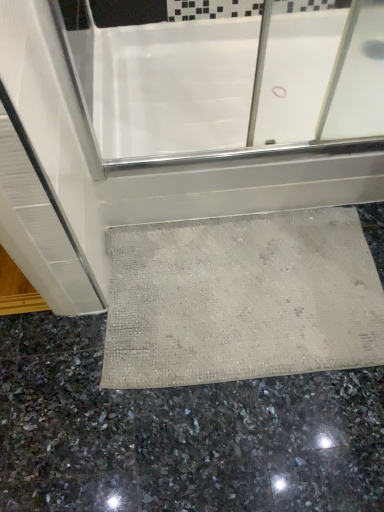
This screenshot has width=384, height=512. What do you see at coordinates (241, 298) in the screenshot? I see `beige textured bath mat at lower center` at bounding box center [241, 298].

Measure the distance between gray polished granite at lower center and camera.

They are 37.48 inches apart.

Describe the element at coordinates (291, 74) in the screenshot. I see `white glossy bathtub at center` at that location.

Find the location of `beige textured bath mat at lower center`. beige textured bath mat at lower center is located at coordinates (241, 298).

From a real-world perspective, which is physically below, white glossy bathtub at center or beige textured bath mat at lower center?

beige textured bath mat at lower center.

Can you confirm if white glossy bathtub at center is smaller than beige textured bath mat at lower center?

No.

Where is `bath mat below the white glossy bathtub at center (from the image's perspective)`? bath mat below the white glossy bathtub at center (from the image's perspective) is located at coordinates (241, 298).

Is white glossy bathtub at center thinner than beige textured bath mat at lower center?

No.

Does white glossy bathtub at center have a larger size compared to gray polished granite at lower center?

Indeed, white glossy bathtub at center has a larger size compared to gray polished granite at lower center.

Identify the location of bath above the gray polished granite at lower center (from a real-world perspective). Image resolution: width=384 pixels, height=512 pixels. pyautogui.click(x=291, y=74).

Is white glossy bathtub at center oriented away from gray polished granite at lower center?

white glossy bathtub at center is not turned away from gray polished granite at lower center.

Can we say white glossy bathtub at center lies outside gray polished granite at lower center?

Yes, white glossy bathtub at center is not within gray polished granite at lower center.

Is gray polished granite at lower center to the left of white glossy bathtub at center from the viewer's perspective?

Indeed, gray polished granite at lower center is positioned on the left side of white glossy bathtub at center.

Does gray polished granite at lower center have a greater height compared to white glossy bathtub at center?

Incorrect, the height of gray polished granite at lower center is not larger of that of white glossy bathtub at center.

Is gray polished granite at lower center placed right next to white glossy bathtub at center?

No, gray polished granite at lower center is not with white glossy bathtub at center.

In the image, is beige textured bath mat at lower center positioned in front of or behind white glossy bathtub at center?

Visually, beige textured bath mat at lower center is located in front of white glossy bathtub at center.

Which of these two, beige textured bath mat at lower center or white glossy bathtub at center, is thinner?

beige textured bath mat at lower center.

How many degrees apart are the facing directions of beige textured bath mat at lower center and white glossy bathtub at center?

0.822 degrees separate the facing orientations of beige textured bath mat at lower center and white glossy bathtub at center.

Is beige textured bath mat at lower center directly adjacent to white glossy bathtub at center?

No, beige textured bath mat at lower center is not with white glossy bathtub at center.

From the picture: Does beige textured bath mat at lower center have a lesser width compared to gray polished granite at lower center?

Yes.

Who is bigger, beige textured bath mat at lower center or gray polished granite at lower center?

gray polished granite at lower center is bigger.

Based on the photo, considering the relative positions of beige textured bath mat at lower center and gray polished granite at lower center in the image provided, is beige textured bath mat at lower center to the left of gray polished granite at lower center from the viewer's perspective?

No.

Does gray polished granite at lower center have a larger size compared to beige textured bath mat at lower center?

Indeed, gray polished granite at lower center has a larger size compared to beige textured bath mat at lower center.

Can you confirm if gray polished granite at lower center is thinner than beige textured bath mat at lower center?

No, gray polished granite at lower center is not thinner than beige textured bath mat at lower center.

From a real-world perspective, who is located lower, gray polished granite at lower center or beige textured bath mat at lower center?

gray polished granite at lower center.

How distant is gray polished granite at lower center from beige textured bath mat at lower center?

gray polished granite at lower center is 7.87 inches away from beige textured bath mat at lower center.

Image resolution: width=384 pixels, height=512 pixels. Identify the location of bath mat that is on the left side of white glossy bathtub at center. (241, 298).

Image resolution: width=384 pixels, height=512 pixels. Identify the location of bath on the right of gray polished granite at lower center. (291, 74).

When comparing their distances from beige textured bath mat at lower center, does white glossy bathtub at center or gray polished granite at lower center seem further?

white glossy bathtub at center lies further to beige textured bath mat at lower center than the other object.

From the picture: Looking at the image, which one is located further to beige textured bath mat at lower center, gray polished granite at lower center or white glossy bathtub at center?

Among the two, white glossy bathtub at center is located further to beige textured bath mat at lower center.

Which object lies further to the anchor point white glossy bathtub at center, beige textured bath mat at lower center or gray polished granite at lower center?

gray polished granite at lower center.

From the image, which object appears to be nearer to gray polished granite at lower center, white glossy bathtub at center or beige textured bath mat at lower center?

Among the two, beige textured bath mat at lower center is located nearer to gray polished granite at lower center.

Based on their spatial positions, is gray polished granite at lower center or beige textured bath mat at lower center further from white glossy bathtub at center?

The object further to white glossy bathtub at center is gray polished granite at lower center.

In the scene shown: Based on their spatial positions, is beige textured bath mat at lower center or white glossy bathtub at center further from gray polished granite at lower center?

white glossy bathtub at center lies further to gray polished granite at lower center than the other object.

Where is `bath mat between white glossy bathtub at center and gray polished granite at lower center from top to bottom`? The image size is (384, 512). bath mat between white glossy bathtub at center and gray polished granite at lower center from top to bottom is located at coordinates (241, 298).